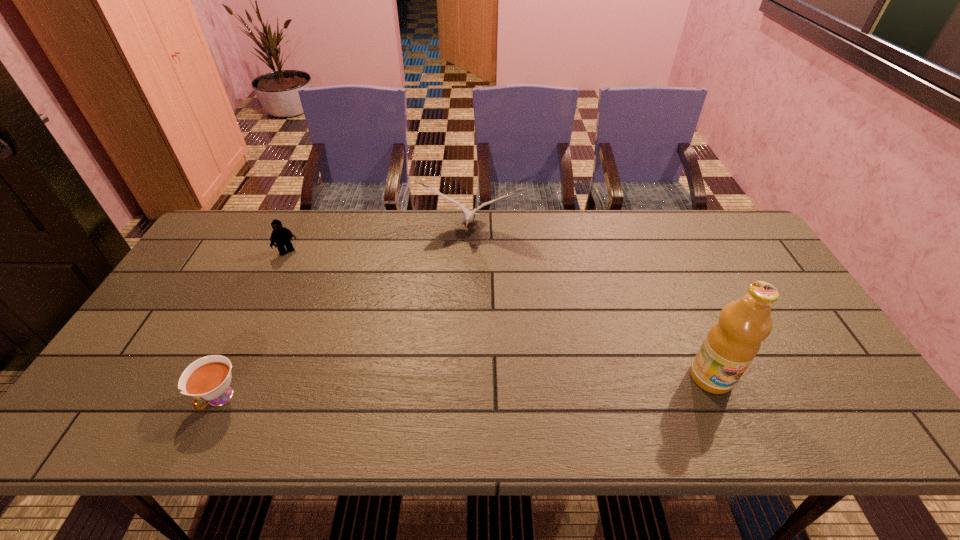
Locate an element on the screen. empty location between the third object from left to right and the teacup is located at coordinates (345, 315).

Identify which object is the third nearest to the shortest object. Please provide its 2D coordinates. Your answer should be formatted as a tuple, i.e. [(x, y)], where the tuple contains the x and y coordinates of a point satisfying the conditions above.

[(731, 344)]

This screenshot has height=540, width=960. I want to click on object that is the second closest to the second object from right to left, so click(x=731, y=344).